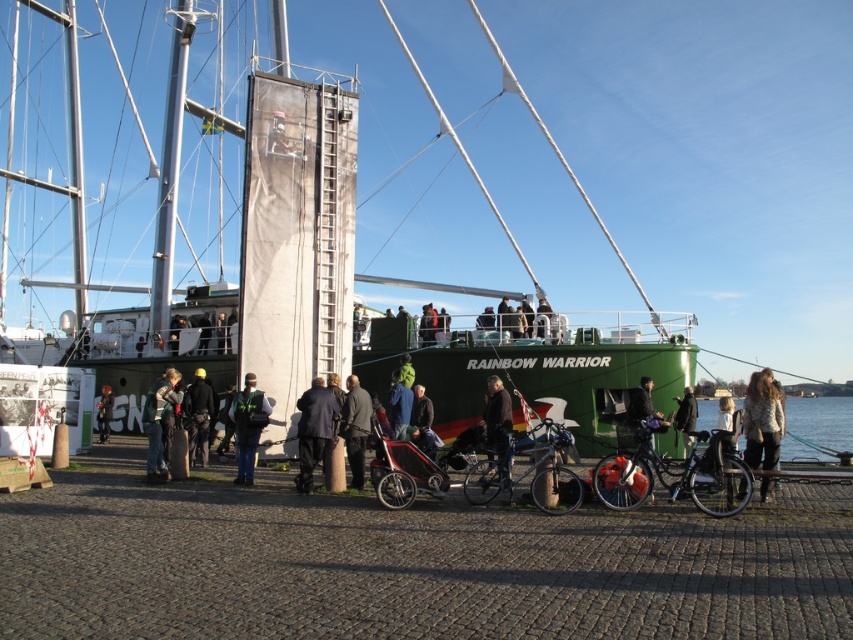
Question: Does brown leather jacket at center lie in front of black leather jacket at center?

Choices:
 (A) yes
 (B) no

Answer: (A)

Question: Based on their relative distances, which object is nearer to the shiny metallic bicycle at center?

Choices:
 (A) shiny black bicycle at center
 (B) dark blue jacket at center
 (C) dark gray jacket at center

Answer: (A)

Question: Can you confirm if dark gray jacket at center is wider than black leather jacket at center?

Choices:
 (A) yes
 (B) no

Answer: (A)

Question: Is clear blue water at lower right positioned before black leather jacket at center?

Choices:
 (A) no
 (B) yes

Answer: (B)

Question: Which point appears farthest from the camera in this image?

Choices:
 (A) (236, 481)
 (B) (569, 438)
 (C) (167, 401)

Answer: (C)

Question: Which object appears farthest from the camera in this image?

Choices:
 (A) white textured jacket at lower right
 (B) shiny black bicycle at center
 (C) reflective green vest at center
 (D) dark gray jacket at center

Answer: (C)